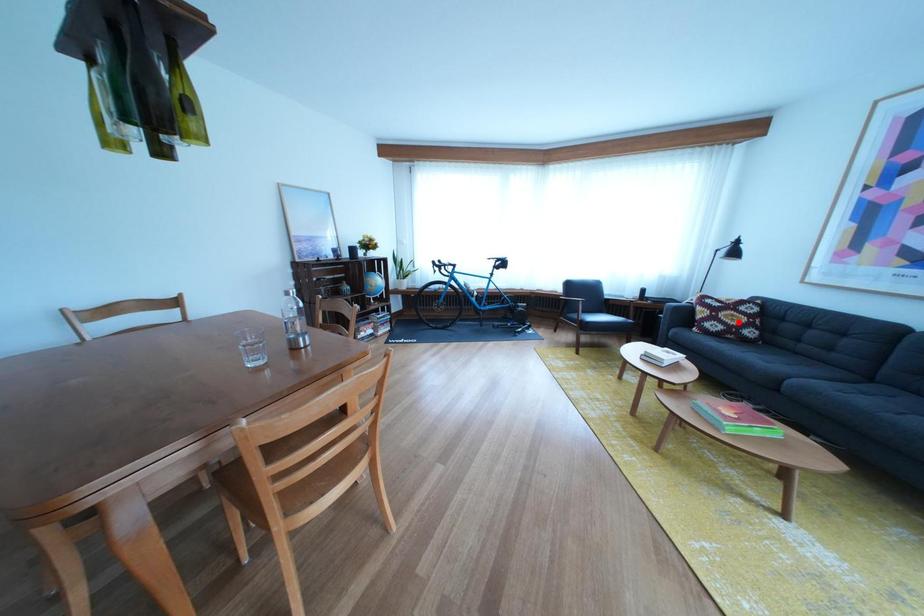
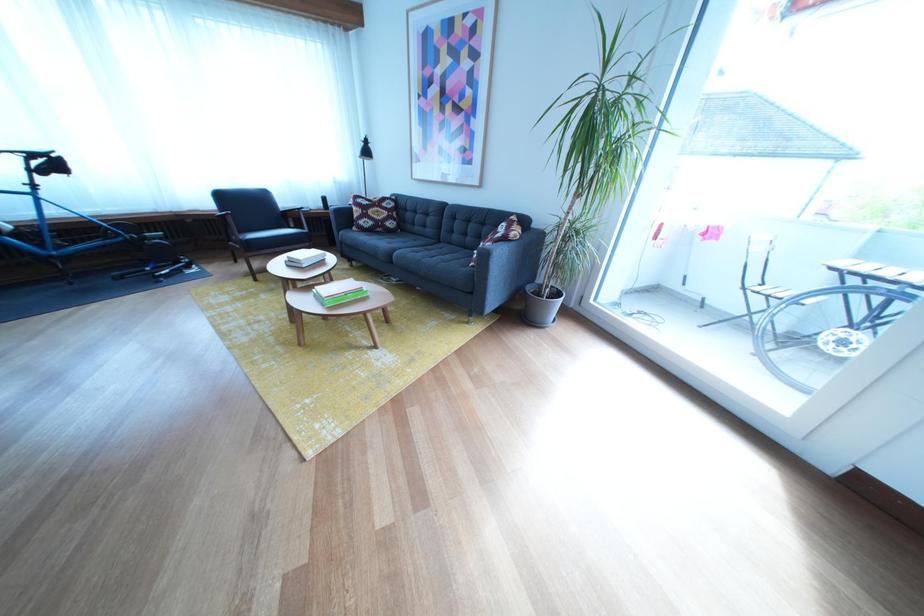
Where in the second image is the point corresponding to the highlighted location from the first image?

(386, 219)